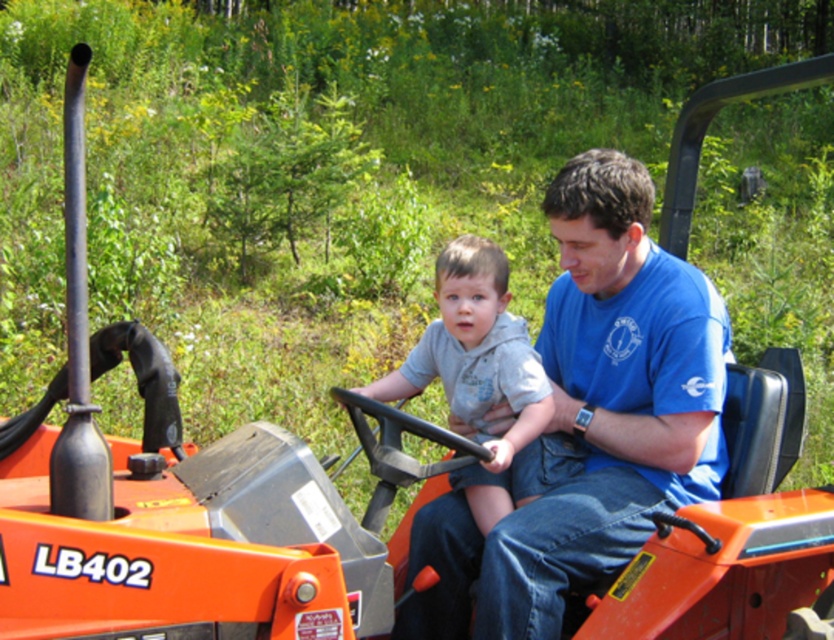
Question: Is blue cotton shirt at center to the left of gray soft hoodie at center from the viewer's perspective?

Choices:
 (A) yes
 (B) no

Answer: (B)

Question: Can you confirm if blue cotton shirt at center is wider than gray soft hoodie at center?

Choices:
 (A) yes
 (B) no

Answer: (A)

Question: Among these objects, which one is nearest to the camera?

Choices:
 (A) gray soft hoodie at center
 (B) blue cotton shirt at center

Answer: (B)

Question: Is blue cotton shirt at center positioned at the back of gray soft hoodie at center?

Choices:
 (A) yes
 (B) no

Answer: (B)